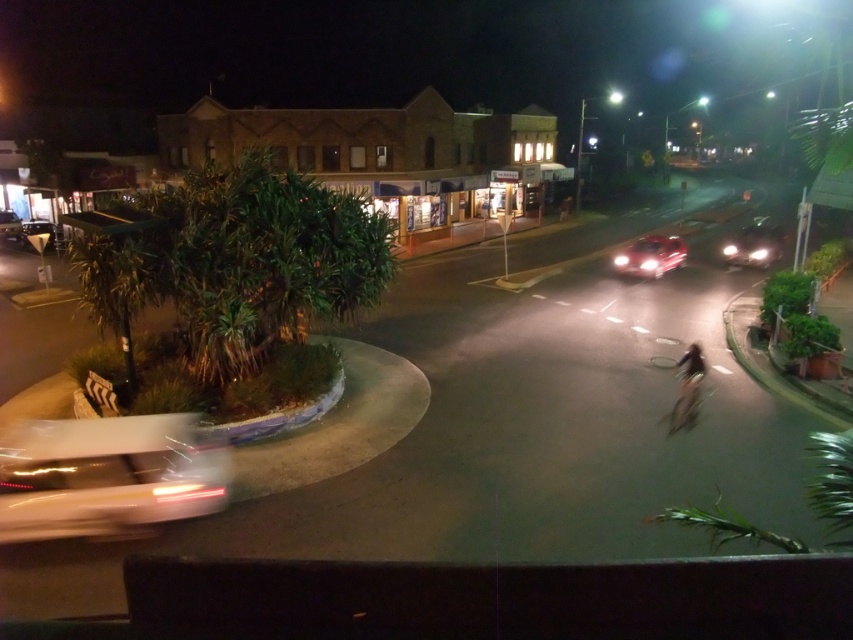
Based on the photo, you are a pedestrian standing at the roundabout and want to cross the road to reach the row of buildings. Which car, the white glossy car at lower left or the glossy red car at center, is closer to you as you cross?

The white glossy car at lower left is closer to you as you cross because it is positioned at the lower left, which is closer to the roundabout where you are standing compared to the glossy red car at center that is further away.

You are a pedestrian standing at the roundabout and want to cross the road to reach the buildings. There are two cars in the scene, the glossy red car at center and the matte silver car at right. Which car is closer to you, and why?

The glossy red car at center is closer to you because it is shorter than the matte silver car at right, which means it appears smaller in the image due to perspective, indicating it is farther away.

You are a pedestrian standing at the roundabout and want to cross the street to reach the buildings. Which car, the white glossy car at lower left or the matte silver car at right, is closer to you?

The white glossy car at lower left is closer to you because it is positioned below the matte silver car at right, indicating it is nearer in the scene.